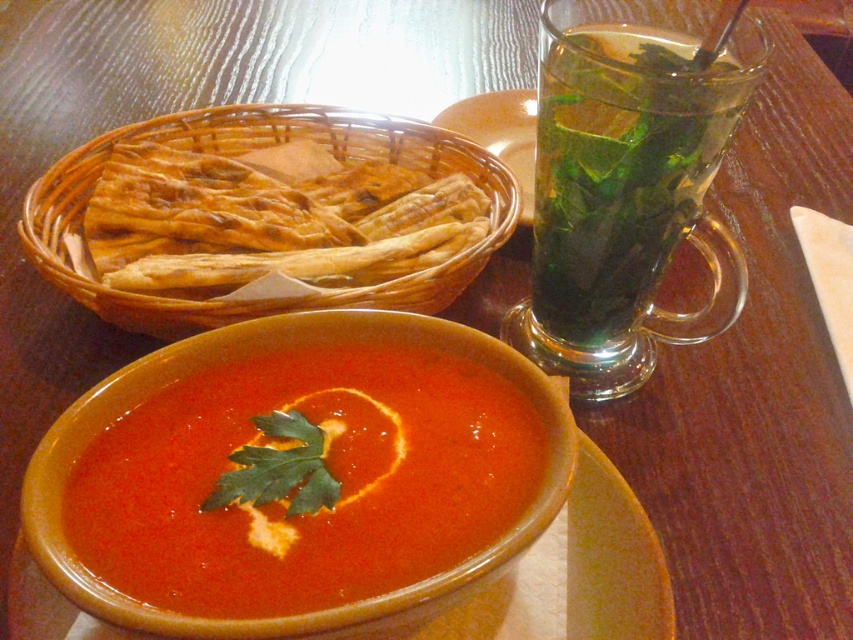
You are a food critic sitting at the table in the image. You want to reach for the green leafy liquid at upper right and the golden brown wicker basket at upper left. Which item is closer to you?

The golden brown wicker basket at upper left is closer to you because the green leafy liquid at upper right is located below it, meaning the basket is positioned above and therefore nearer in this arrangement.

You are a chef standing at the table where the green leafy liquid at upper right is placed. You need to reach it quickly. Is it within arm reach?

The green leafy liquid at upper right is 10.54 inches away from viewer, so yes, it is within arm reach since the average human arm reach is about 28 inches.